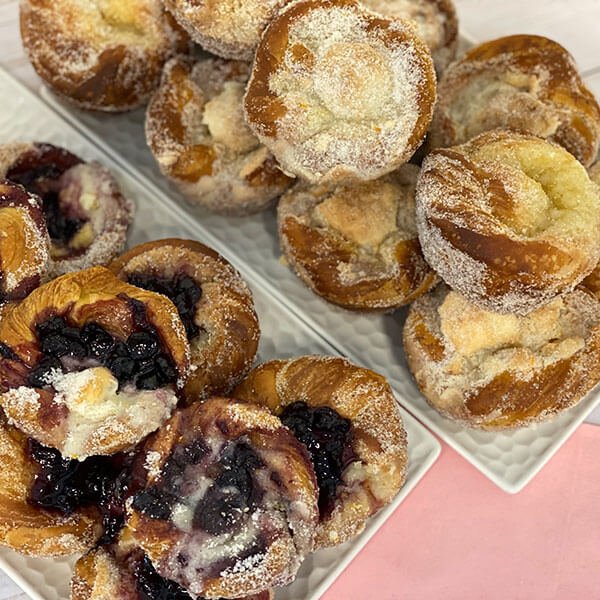
Image resolution: width=600 pixels, height=600 pixels. Find the location of `trays`. trays is located at coordinates (512, 468), (272, 339).